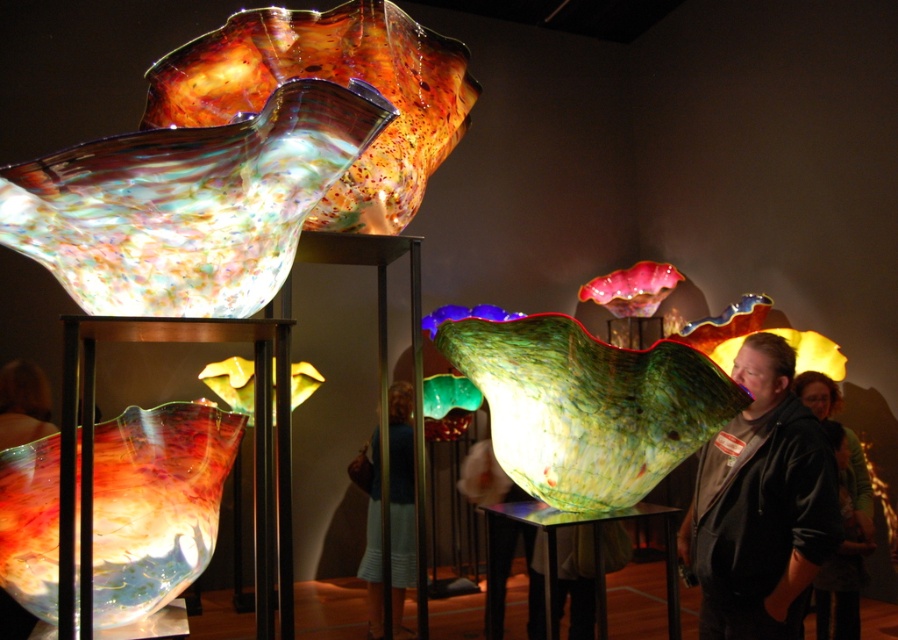
You are an art collector examining the art gallery scene. You see the translucent multicolored glass at left and the dark brown leather jacket at lower right. Which object is located more to the left side of the scene?

The translucent multicolored glass at left is positioned on the left side of dark brown leather jacket at lower right, so it is more to the left.

You are a fashion designer observing the art gallery scene. You notice two jackets displayed near the sculptures. Which jacket would require less fabric to produce, the matte black jacket at right or the dark brown leather jacket at lower right?

The matte black jacket at right requires less fabric to produce because it is thinner than the dark brown leather jacket at lower right.

You are an art curator planning to move the dark brown leather jacket at lower right closer to the translucent multicolored glass at left. Based on their sizes, do you think there will be enough space between them after moving?

The translucent multicolored glass at left might be wider than dark brown leather jacket at lower right, so there may not be enough space between them after moving. It is recommended to check the exact dimensions before proceeding.